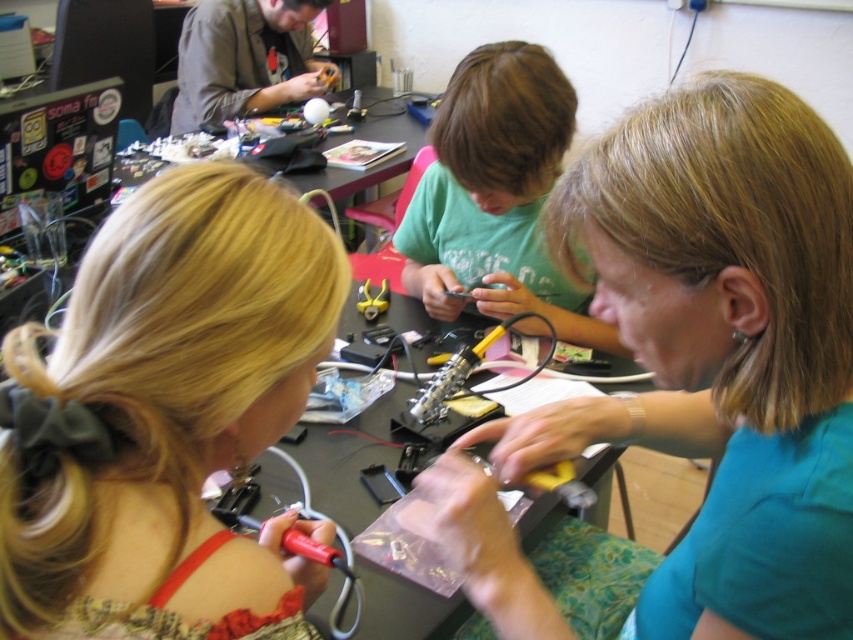
Looking at this image, you are a photographer trying to capture a candid shot of the two women in the scene. You want to ensure both the teal matte shirt at center and the blonde hair at lower left are clearly visible in the frame. Given their distance apart, what is the minimum focal length lens you should use if your camera sensor has a diagonal of 24mm and you want to fill the frame with both subjects without cropping?

The minimum focal length required would be approximately 24mm multiplied by the distance between the subjects divided by the sensor diagonal. However, without knowing the actual distance from the camera to the subjects, an exact calculation isn not possible. A wide angle lens around 35mm would likely capture both the teal matte shirt at center and the blonde hair at lower left in the frame given their 10.60 inches apart.

You are standing in the classroom and need to locate the teal matte shirt at center. Based on the coordinates provided in the Objects Description, can you determine its position relative to the center of the image?

The teal matte shirt at center is located at point coordinates approximately 57.5 percent horizontally and 81.9 percent vertically from the bottom left corner of the image, which places it slightly to the right and lower middle area of the image.

In the scene shown: Where is the blonde hair at lower left located in the image?

The blonde hair at lower left is located at point 0.653 on the x axis and 0.195 on the y axis.